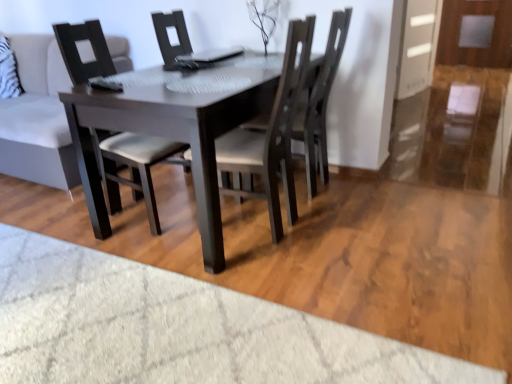
Locate an element on the screen. vacant point to the right of dark wood chair at center, which is counted as the second chair, starting from the right is located at coordinates (346, 228).